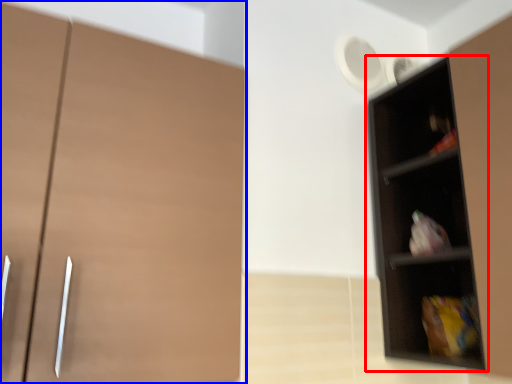
Question: Which point is further to the camera, shelf (highlighted by a red box) or cupboard (highlighted by a blue box)?

Choices:
 (A) shelf
 (B) cupboard

Answer: (A)